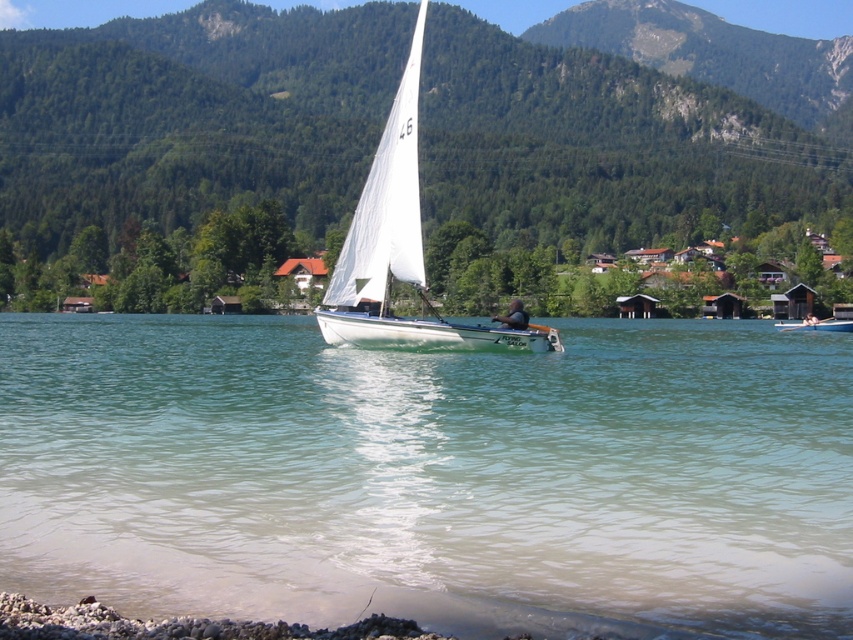
You are standing on the lakeside and want to pick up something from the scene. Which object is easier to reach between the smooth pebbles at lower left and the white sailboat at center?

The smooth pebbles at lower left are closer to the viewer than the white sailboat at center, so it is easier to reach the smooth pebbles at lower left.

You are standing at the lakeside and want to reach the smooth skin person at center in the sailboat. The green forested mountain at upper center is in your way. Can you walk around it to get closer to the person?

The green forested mountain at upper center is 535.99 feet from the smooth skin person at center. Since the mountain is between you and the person, you would need to go around it, but the distance might make it difficult to approach directly.

You are standing at the point marked as point (397, 605) and want to throw a pebble into the lake. The pebble can travel up to 6 meters. Will it reach the water?

The distance between you and the viewer is 7.12 meters, which is greater than the pebble can travel. Therefore, the pebble will not reach the water.